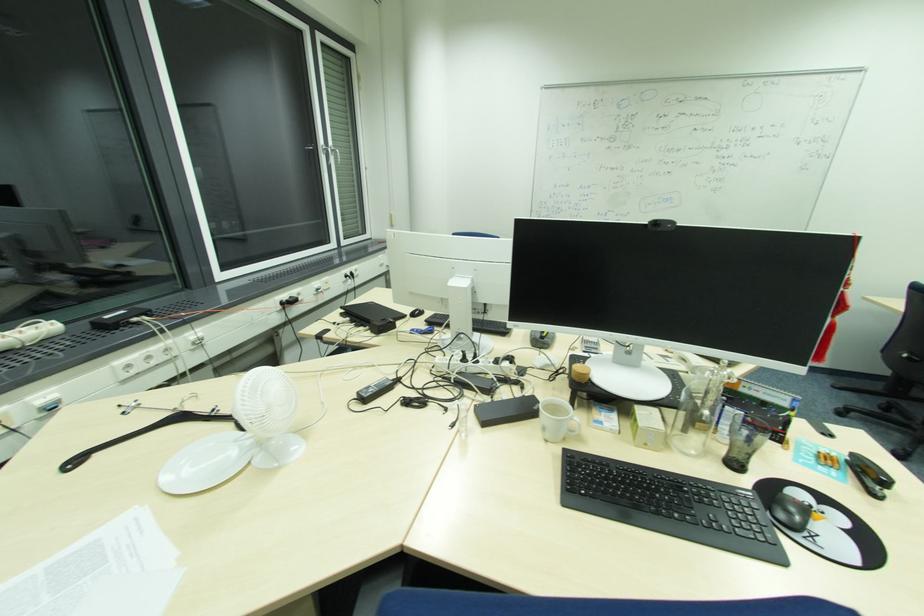
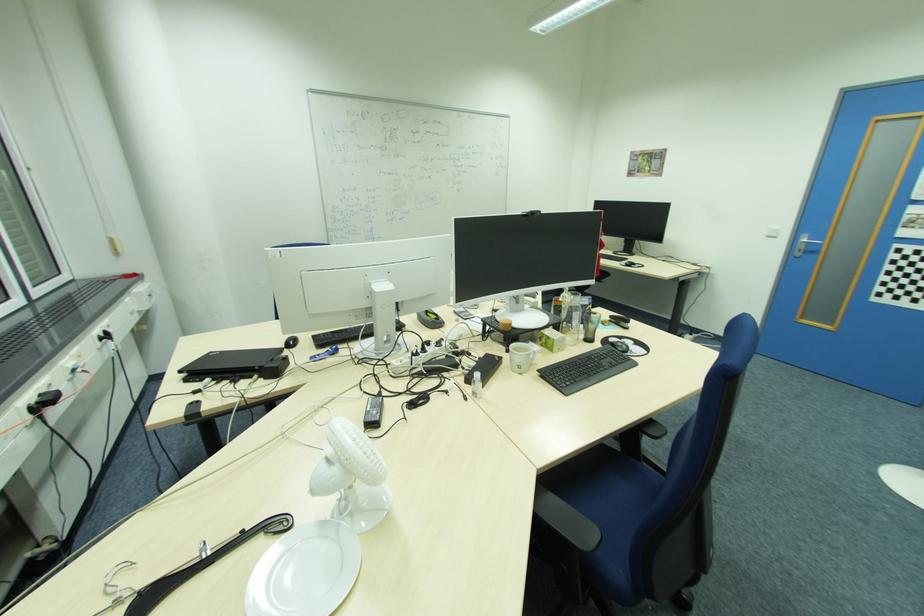
Find the pixel in the second image that matches (x=612, y=419) in the first image.

(536, 346)